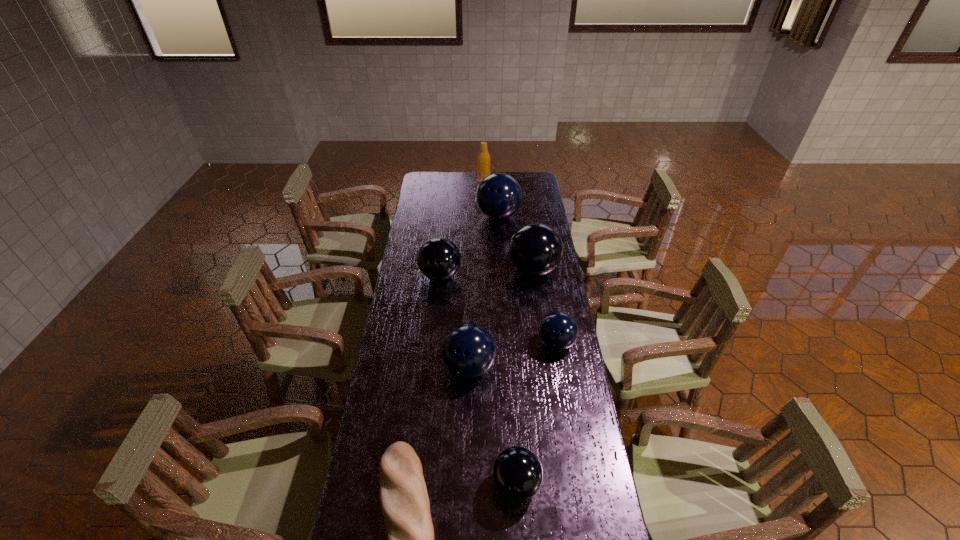
This screenshot has width=960, height=540. I want to click on object that stands as the fifth closest to the farthest object, so click(468, 351).

Point out which bowling ball is positioned as the second nearest to the tan beer bottle. Please provide its 2D coordinates. Your answer should be formatted as a tuple, i.e. [(x, y)], where the tuple contains the x and y coordinates of a point satisfying the conditions above.

[(536, 249)]

Identify which bowling ball is the sixth closest to the beer bottle. Please provide its 2D coordinates. Your answer should be formatted as a tuple, i.e. [(x, y)], where the tuple contains the x and y coordinates of a point satisfying the conditions above.

[(517, 472)]

You are a GUI agent. You are given a task and a screenshot of the screen. Output one action in this format:
    pyautogui.click(x=<x>, y=<y>)
    Task: Click on the blue bowling ball object that ranks as the closest to the farthest object
    
    Given the screenshot: What is the action you would take?
    pyautogui.click(x=499, y=196)

What are the coordinates of `blue bowling ball that is the second closest one to the smallest blue bowling ball` in the screenshot? It's located at (499, 196).

Locate an element on the screen. The image size is (960, 540). black bowling ball object that ranks as the third closest to the shortest object is located at coordinates (536, 249).

I want to click on the closest black bowling ball relative to the second biggest black bowling ball, so tap(536, 249).